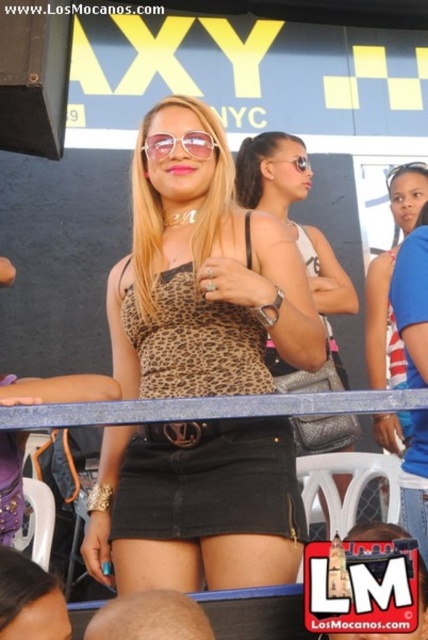
Is point (243, 548) in front of point (207, 147)?

Yes, point (243, 548) is closer to viewer.

Identify the location of leopard print tank top at center. (202, 276).

Is smooth brown skin at lower center thinner than matte black skirt at center?

In fact, smooth brown skin at lower center might be wider than matte black skirt at center.

Is smooth brown skin at lower center closer to camera compared to matte black skirt at center?

Yes, it is in front of matte black skirt at center.

Is point (151, 595) in front of point (353, 529)?

Yes, it is in front of point (353, 529).

Locate an element on the screen. This screenshot has width=428, height=640. smooth brown skin at lower center is located at coordinates (149, 618).

Can you confirm if matte black tank top at center is positioned above dark brown hair at center?

Yes, matte black tank top at center is above dark brown hair at center.

Is matte black tank top at center wider than dark brown hair at center?

Indeed, matte black tank top at center has a greater width compared to dark brown hair at center.

Who is more forward, (x=404, y=173) or (x=23, y=605)?

A: Point (x=23, y=605) is in front.

At what (x,y) coordinates should I click in order to perform the action: click on matte black tank top at center. Please return your answer as a coordinate pair (x, y). This screenshot has height=640, width=428. Looking at the image, I should click on (383, 326).